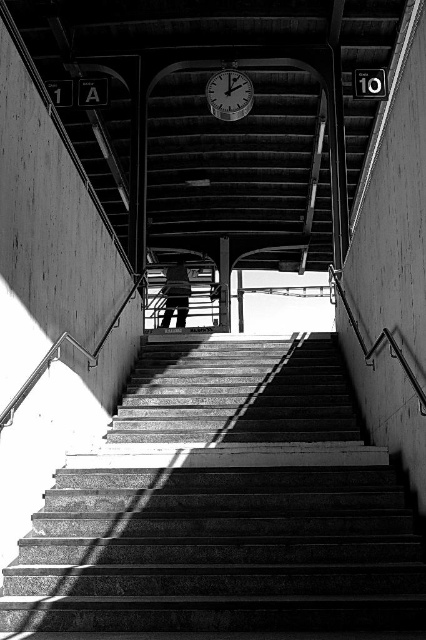
Question: Can you confirm if concrete stairs at center is positioned below metallic clock at center?

Choices:
 (A) no
 (B) yes

Answer: (B)

Question: Which of the following is the closest to the observer?

Choices:
 (A) (178, 276)
 (B) (209, 84)

Answer: (B)

Question: Is metallic silver skateboard at center bigger than smooth concrete pillar at center?

Choices:
 (A) no
 (B) yes

Answer: (B)

Question: Does concrete stairs at center have a larger size compared to smooth concrete pillar at center?

Choices:
 (A) no
 (B) yes

Answer: (A)

Question: Estimate the real-world distances between objects in this image. Which object is farther from the smooth concrete pillar at center?

Choices:
 (A) concrete stairs at center
 (B) metallic silver skateboard at center

Answer: (A)

Question: Among these objects, which one is farthest from the camera?

Choices:
 (A) concrete stairs at center
 (B) metallic clock at center
 (C) smooth concrete pillar at center

Answer: (C)